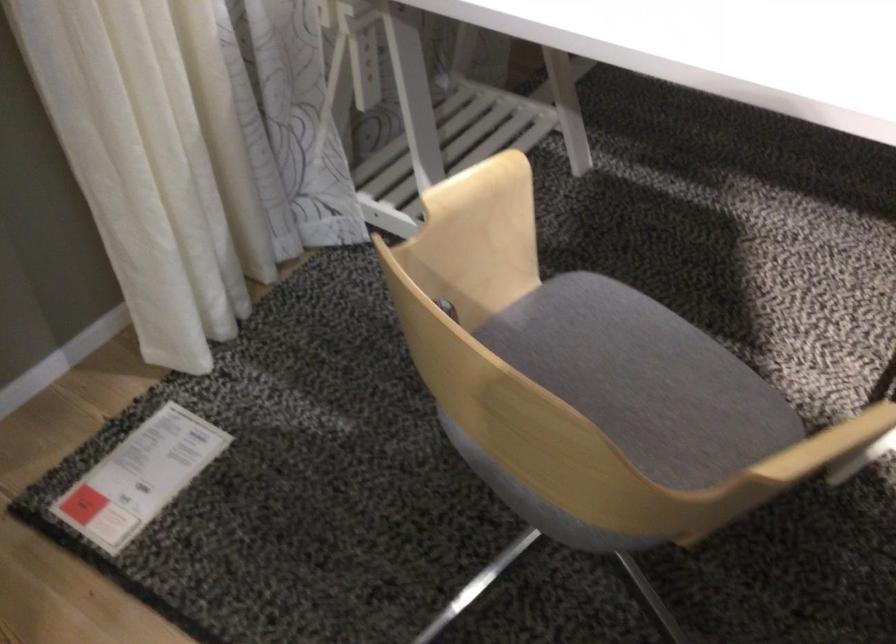
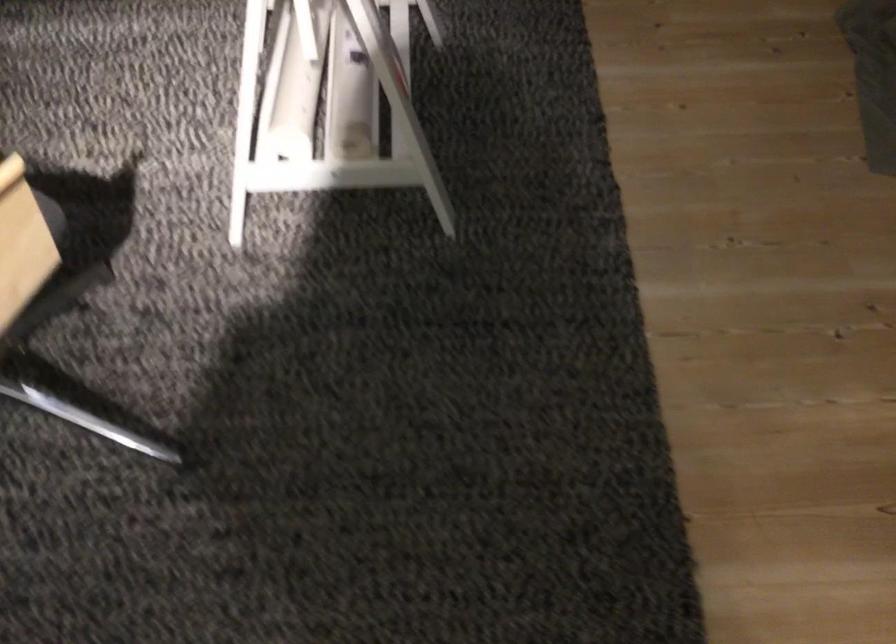
Question: The camera is either moving clockwise (left) or counter-clockwise (right) around the object. The first image is from the beginning of the video and the second image is from the end. Is the camera moving left or right when shooting the video?

Choices:
 (A) Left
 (B) Right

Answer: (A)